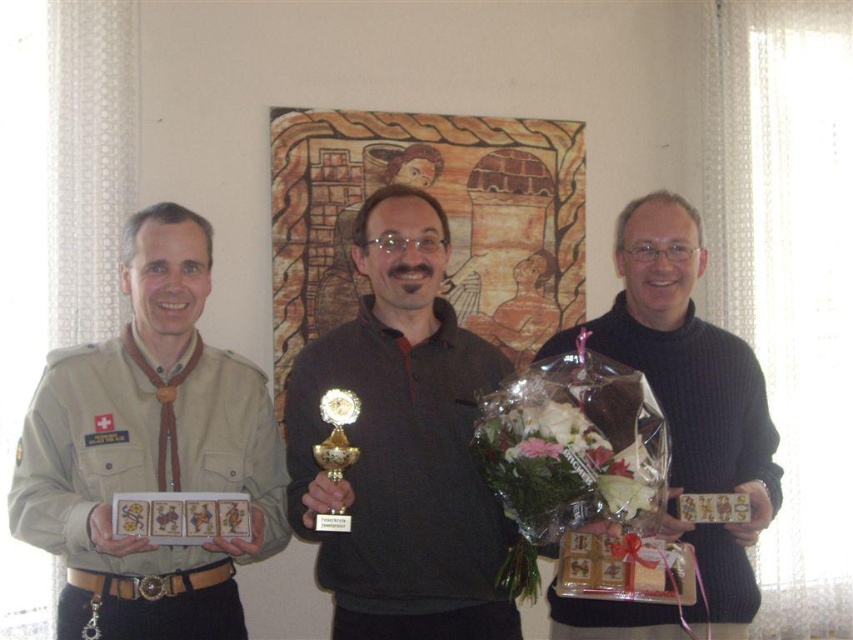
Question: Can you confirm if fluffy bouquet at center is wider than gold metallic medal at center?

Choices:
 (A) no
 (B) yes

Answer: (B)

Question: Can you confirm if gold plated trophy at center is bigger than metallic gold medal at center?

Choices:
 (A) no
 (B) yes

Answer: (B)

Question: Which of the following is the closest to the observer?

Choices:
 (A) matte black polo shirt at center
 (B) beige uniform at left
 (C) gold plated trophy at center

Answer: (C)

Question: Considering the real-world distances, which object is farthest from the gold metallic medal at center?

Choices:
 (A) fluffy bouquet at center
 (B) black matte sweater at center
 (C) gold plated trophy at center
 (D) metallic gold medal at center

Answer: (B)

Question: Which point appears farthest from the camera in this image?

Choices:
 (A) [97, 630]
 (B) [158, 392]
 (C) [422, 438]
 (D) [659, 193]

Answer: (D)

Question: Does matte black polo shirt at center lie behind fluffy bouquet at center?

Choices:
 (A) yes
 (B) no

Answer: (B)